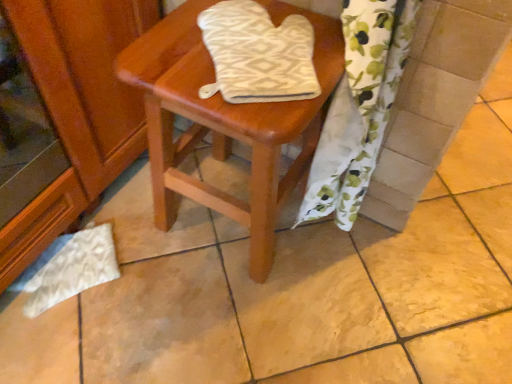
Find the location of `free location to the right of white floral fabric at lower right`. free location to the right of white floral fabric at lower right is located at coordinates (386, 258).